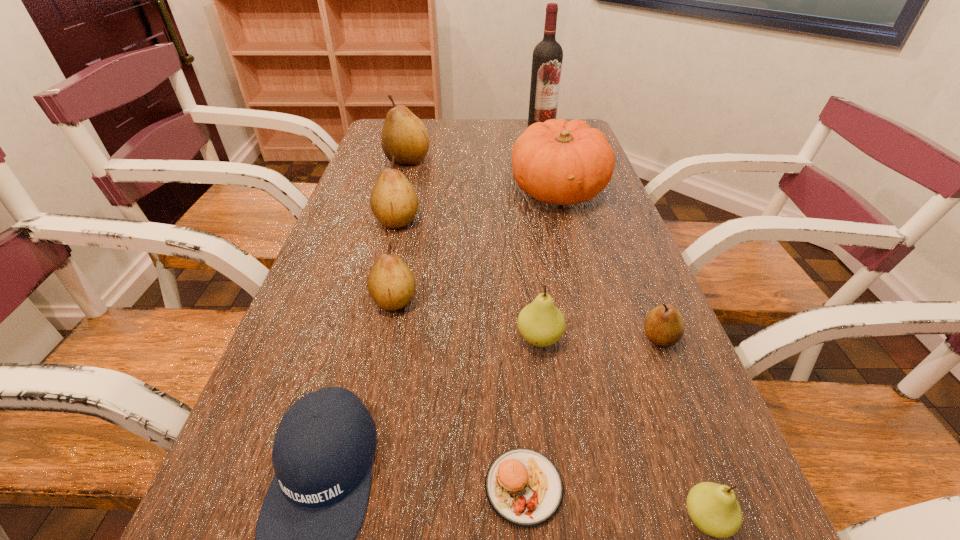
At what (x,y) coordinates should I click in order to perform the action: click on free space located 0.070m on the back of the nearest brown pear. Please return your answer as a coordinate pair (x, y). Image resolution: width=960 pixels, height=540 pixels. Looking at the image, I should click on (644, 299).

You are a GUI agent. You are given a task and a screenshot of the screen. Output one action in this format:
    pyautogui.click(x=<x>, y=<y>)
    Task: Click on the free space located 0.060m on the back of the shortest object
    This screenshot has height=540, width=960.
    Given the screenshot: What is the action you would take?
    pyautogui.click(x=518, y=415)

Identify the location of object that is at the far edge. (547, 58).

Identify the location of wine bottle that is at the right edge. (547, 58).

Image resolution: width=960 pixels, height=540 pixels. Find the location of `pumpkin at the right edge`. pumpkin at the right edge is located at coordinates (558, 162).

I want to click on pear that is at the right edge, so click(664, 326).

Locate an element on the screen. Image resolution: width=960 pixels, height=540 pixels. object located in the far right corner section of the desktop is located at coordinates click(x=547, y=58).

In the image, there is a desktop. Where is `free space at the far edge`? This screenshot has width=960, height=540. free space at the far edge is located at coordinates (465, 139).

This screenshot has width=960, height=540. Identify the location of free space at the left edge of the desktop. (356, 188).

You are a GUI agent. You are given a task and a screenshot of the screen. Output one action in this format:
    pyautogui.click(x=<x>, y=<y>)
    Task: Click on the vacant area at the right edge
    Image resolution: width=960 pixels, height=540 pixels.
    Given the screenshot: What is the action you would take?
    pyautogui.click(x=580, y=214)